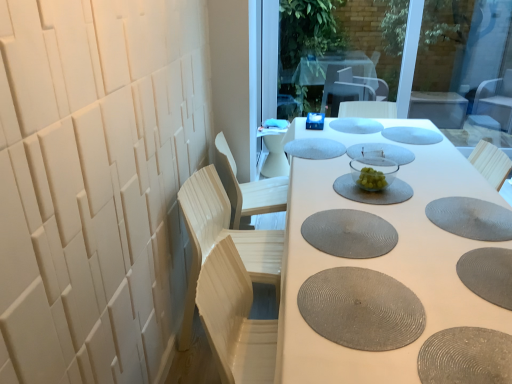
Identify the location of vacant area that lies between gray rubber mat at center, which appears as the 9th manhole cover when viewed from the front, and blue fabric cushion at center, the 10th manhole cover positioned from the front. Image resolution: width=512 pixels, height=384 pixels. (368, 130).